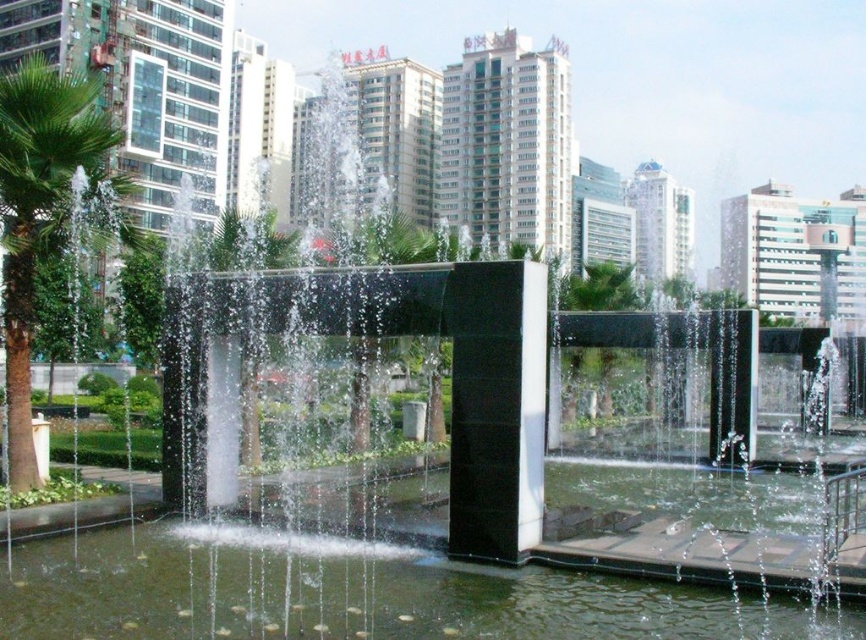
You are standing in the urban park and want to take a photo of both the clear water at center and the green leafy palm tree at left. To ensure both are visible in the frame, which object should you position closer to the edge of your camera viewfinder?

You should position the green leafy palm tree at left closer to the edge of your camera viewfinder because the clear water at center is on the right side of the green leafy palm tree at left, so placing the palm tree near the left edge will allow the water to be captured on the right side within the frame.

You are a drone operator planning to fly a drone with a wingspan of 1 meter over the modern urban park. The drone must pass between the clear water at center and the green leafy palm tree at left. Based on the scene, can the drone safely navigate this path without hitting either object?

The clear water at center has a lesser width compared to the green leafy palm tree at left. Since the clear water at center is narrower, the space between them might be insufficient for the drone with a 1 meter wingspan. However, without exact measurements of the distance between the two objects, it is uncertain. The answer cannot be definitively determined from the provided information.